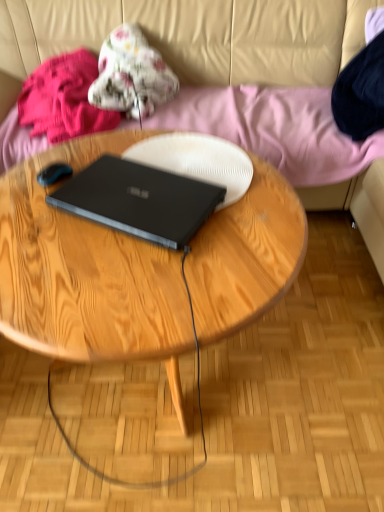
Question: From a real-world perspective, is wooden coffee table at center on top of black matte laptop at center?

Choices:
 (A) yes
 (B) no

Answer: (B)

Question: Is wooden coffee table at center at the right side of black matte laptop at center?

Choices:
 (A) yes
 (B) no

Answer: (A)

Question: Are wooden coffee table at center and black matte laptop at center far apart?

Choices:
 (A) no
 (B) yes

Answer: (A)

Question: From the image's perspective, is wooden coffee table at center located beneath black matte laptop at center?

Choices:
 (A) yes
 (B) no

Answer: (A)

Question: Is black matte laptop at center a part of wooden coffee table at center?

Choices:
 (A) no
 (B) yes

Answer: (B)

Question: Considering the relative sizes of wooden coffee table at center and black matte laptop at center in the image provided, is wooden coffee table at center smaller than black matte laptop at center?

Choices:
 (A) yes
 (B) no

Answer: (B)

Question: Is wooden coffee table at center surrounding fluffy floral blanket at upper center, placed as the 2th clothing when sorted from left to right?

Choices:
 (A) yes
 (B) no

Answer: (B)

Question: Considering the relative sizes of wooden coffee table at center and fluffy floral blanket at upper center, placed as the 2th clothing when sorted from left to right, in the image provided, is wooden coffee table at center smaller than fluffy floral blanket at upper center, placed as the 2th clothing when sorted from left to right,?

Choices:
 (A) no
 (B) yes

Answer: (A)

Question: Is the position of wooden coffee table at center more distant than that of fluffy floral blanket at upper center, which is the 1th clothing from right to left?

Choices:
 (A) no
 (B) yes

Answer: (A)

Question: From the image's perspective, is wooden coffee table at center located above fluffy floral blanket at upper center, which is the 1th clothing from right to left?

Choices:
 (A) no
 (B) yes

Answer: (A)

Question: Is wooden coffee table at center outside of fluffy floral blanket at upper center, which is the 1th clothing from right to left?

Choices:
 (A) yes
 (B) no

Answer: (A)

Question: Can you confirm if wooden coffee table at center is shorter than fluffy floral blanket at upper center, which is the 1th clothing from right to left?

Choices:
 (A) no
 (B) yes

Answer: (A)

Question: Could fluffy pink blanket at upper left, marked as the first clothing in a left-to-right arrangement, be considered to be inside fluffy floral blanket at upper center, placed as the 2th clothing when sorted from left to right?

Choices:
 (A) no
 (B) yes

Answer: (A)